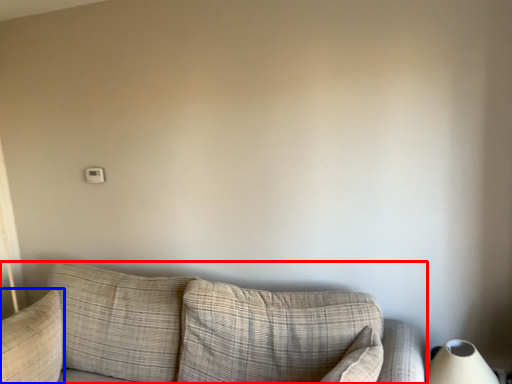
Question: Which of the following is the closest to the observer, studio couch (highlighted by a red box) or pillow (highlighted by a blue box)?

Choices:
 (A) studio couch
 (B) pillow

Answer: (A)